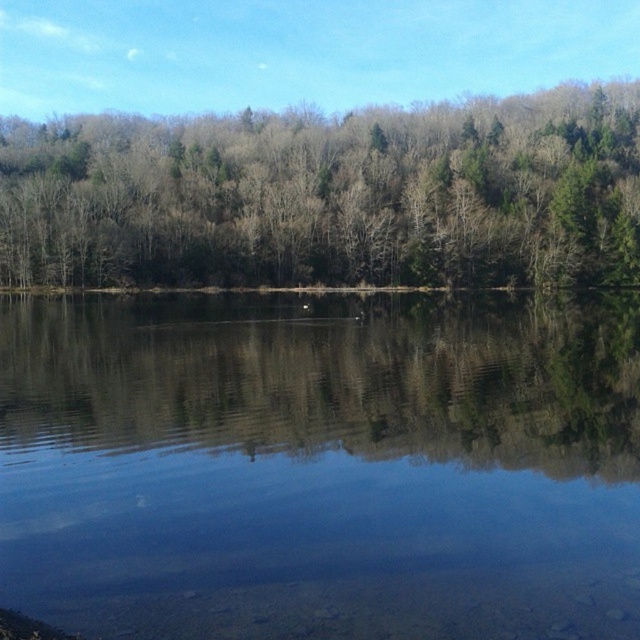
Question: Can you confirm if clear water at center is positioned to the right of green matte trees at center?

Choices:
 (A) yes
 (B) no

Answer: (B)

Question: Which point is closer to the camera?

Choices:
 (A) (460, 244)
 (B) (308, 410)

Answer: (B)

Question: Can you confirm if clear water at center is positioned above green matte trees at center?

Choices:
 (A) no
 (B) yes

Answer: (A)

Question: Which object appears closest to the camera in this image?

Choices:
 (A) green matte trees at center
 (B) clear water at center

Answer: (B)

Question: Is clear water at center bigger than green matte trees at center?

Choices:
 (A) yes
 (B) no

Answer: (B)

Question: Which object appears closest to the camera in this image?

Choices:
 (A) clear water at center
 (B) green matte trees at center

Answer: (A)